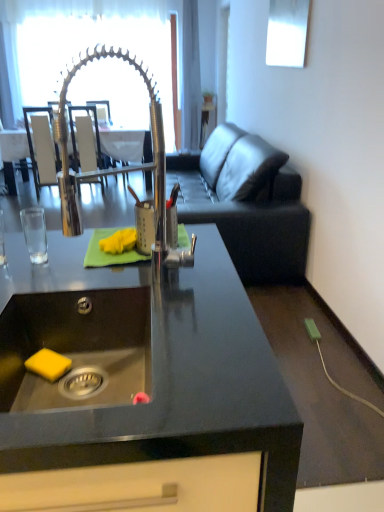
Question: In the image, is black granite countertop at center positioned in front of or behind white leather armchair at upper left, the 1th armchair viewed from the left?

Choices:
 (A) front
 (B) behind

Answer: (A)

Question: From the image's perspective, is black granite countertop at center above or below white leather armchair at upper left, the 1th armchair viewed from the left?

Choices:
 (A) below
 (B) above

Answer: (A)

Question: Which object is positioned farthest from the white leather armchair at upper left, the 1th armchair viewed from the left?

Choices:
 (A) clear glass door at upper center
 (B) dark gray leather couch at right
 (C) black granite countertop at center
 (D) polished chrome tap at center
 (E) wooden armchair at center, which appears as the 1th armchair when viewed from the right

Answer: (A)

Question: Considering the real-world distances, which object is closest to the black granite countertop at center?

Choices:
 (A) wooden armchair at center, acting as the 2th armchair starting from the left
 (B) white leather armchair at upper left, which is the 2th armchair in right-to-left order
 (C) dark gray leather couch at right
 (D) stainless steel sink at lower left
 (E) clear glass door at upper center

Answer: (D)